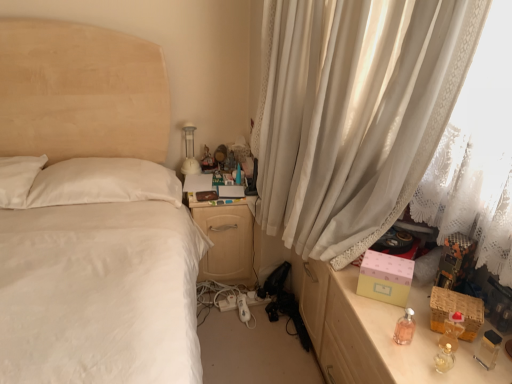
Question: Would you say white sheer curtain at right is inside or outside pink glass perfume at lower right, which is the second perfume in right-to-left order?

Choices:
 (A) outside
 (B) inside

Answer: (A)

Question: Is white sheer curtain at right taller or shorter than pink glass perfume at lower right, which is the second perfume in right-to-left order?

Choices:
 (A) short
 (B) tall

Answer: (B)

Question: Based on their relative distances, which object is nearer to the translucent amber bottle at right, the 2th perfume in the left-to-right sequence?

Choices:
 (A) pink glass perfume at lower right, which is the second perfume in right-to-left order
 (B) white glossy table lamp at upper center
 (C) matte pink box at right
 (D) matte plastic figurine at upper center
 (E) white sheer curtain at right

Answer: (A)

Question: Based on their relative distances, which object is farther from the translucent amber bottle at right, the 2th perfume in the left-to-right sequence?

Choices:
 (A) matte pink box at right
 (B) white sheer curtain at right
 (C) white glossy table lamp at upper center
 (D) light wood/wooden nightstand at center
 (E) pink glass perfume at lower right, which is the second perfume in right-to-left order

Answer: (C)